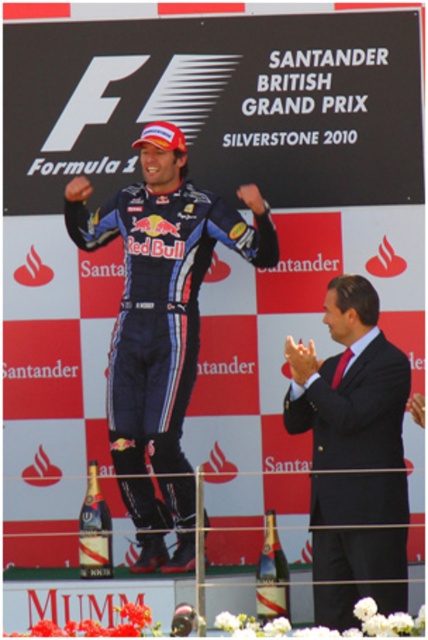
Looking at this image, you are a photographer at the event and need to capture a closeup shot of both the black suit at center and the translucent glass bottle at center. Given their sizes, which object should you position closer to the camera to ensure both appear equally large in the photo?

The black suit at center has a larger size compared to the translucent glass bottle at center. To make them appear equally large in the photo, you should position the translucent glass bottle at center closer to the camera than the black suit at center.

You are a photographer at the event and need to capture a clear shot of the black suit at center and the translucent glass bottle at center. From your current position, which object is closer to you?

The black suit at center is closer to you because it is in front of the translucent glass bottle at center.

You are a photographer at the event and need to capture a closeup of both the shiny blue suit at center and the black suit at center. Given their sizes, which suit should you focus on first to ensure it fits within your camera frame?

The shiny blue suit at center is larger in size than the black suit at center, so you should focus on capturing the shiny blue suit at center first to ensure it fits within your camera frame before adjusting for the smaller black suit at center.